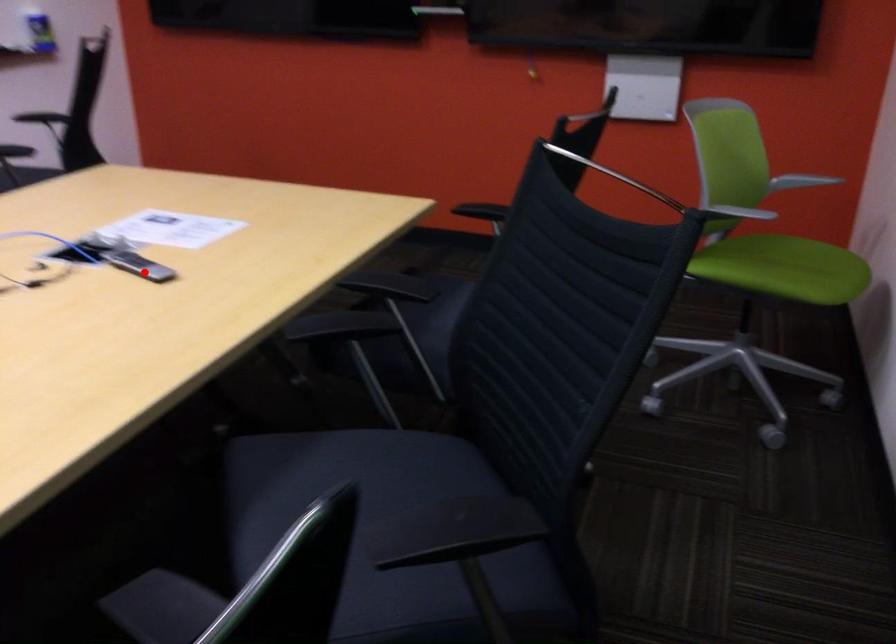
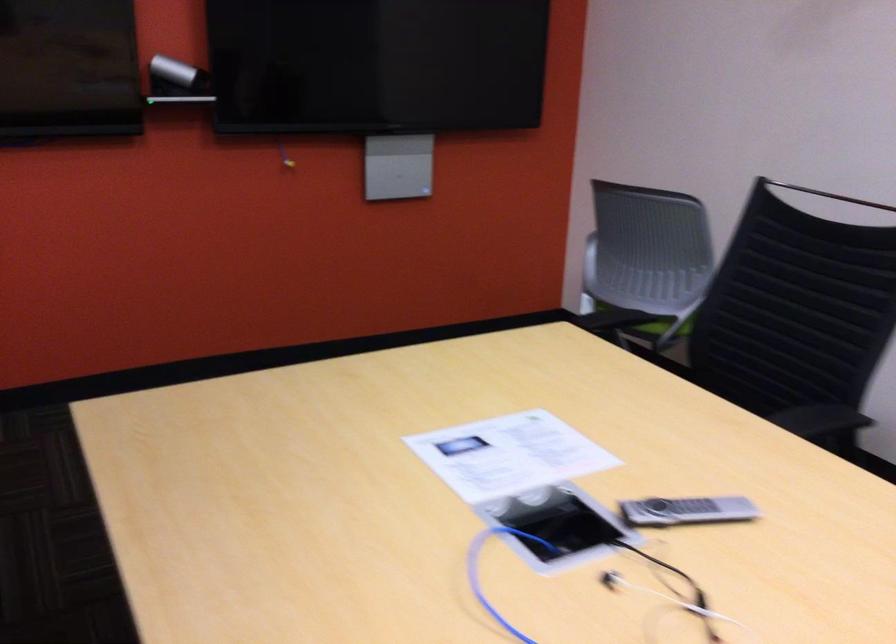
Where in the second image is the point corresponding to the highlighted location from the first image?

(686, 511)